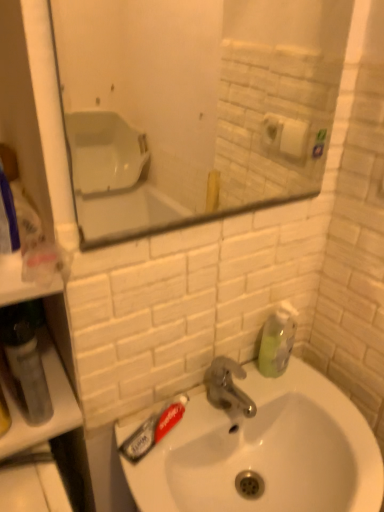
Describe the element at coordinates (25, 370) in the screenshot. The width and height of the screenshot is (384, 512). I see `translucent plastic mouthwash at left` at that location.

Image resolution: width=384 pixels, height=512 pixels. What do you see at coordinates (277, 340) in the screenshot?
I see `green translucent soap dispenser at right` at bounding box center [277, 340].

Identify the location of green translucent soap dispenser at right. The width and height of the screenshot is (384, 512). (277, 340).

Image resolution: width=384 pixels, height=512 pixels. Identify the location of white glossy sink at center. (265, 451).

What is the approximate height of white glossy sink at center?

white glossy sink at center is 5.68 inches tall.

At what (x,y) coordinates should I click in order to perform the action: click on translucent plastic toothpaste at sink left. Please return your answer as a coordinate pair (x, y). Looking at the image, I should click on (153, 429).

The image size is (384, 512). I want to click on translucent plastic mouthwash at left, so click(25, 370).

Is white glossy sink at center positioned behind translucent plastic mouthwash at left?

No.

Is white glossy sink at center at the right side of translucent plastic mouthwash at left?

Indeed, white glossy sink at center is positioned on the right side of translucent plastic mouthwash at left.

Is white glossy sink at center far from translucent plastic mouthwash at left?

No, white glossy sink at center is not far from translucent plastic mouthwash at left.

From a real-world perspective, is white glossy sink at center positioned above or below translucent plastic mouthwash at left?

In terms of real-world spatial position, white glossy sink at center is below translucent plastic mouthwash at left.

Considering the sizes of white glossy sink at center and matte glass mirror at upper center in the image, is white glossy sink at center wider or thinner than matte glass mirror at upper center?

Considering their sizes, white glossy sink at center looks broader than matte glass mirror at upper center.

Which of these two, white glossy sink at center or matte glass mirror at upper center, is smaller?

Smaller between the two is matte glass mirror at upper center.

In the scene shown: From the image's perspective, is white glossy sink at center on matte glass mirror at upper center?

No, from the image's perspective, white glossy sink at center is not over matte glass mirror at upper center.

How many degrees apart are the facing directions of matte glass mirror at upper center and white glossy sink at center?

0.299 degrees.

Is there a large distance between matte glass mirror at upper center and white glossy sink at center?

matte glass mirror at upper center is far away from white glossy sink at center.

Who is shorter, matte glass mirror at upper center or white glossy sink at center?

white glossy sink at center.

From the image's perspective, does matte glass mirror at upper center appear higher than white glossy sink at center?

Yes, from the image's perspective, matte glass mirror at upper center is on top of white glossy sink at center.

Is translucent plastic mouthwash at left located within green translucent soap dispenser at right?

No, translucent plastic mouthwash at left is not a part of green translucent soap dispenser at right.

Is green translucent soap dispenser at right to the left of translucent plastic mouthwash at left from the viewer's perspective?

No, green translucent soap dispenser at right is not to the left of translucent plastic mouthwash at left.

Between point (275, 371) and point (41, 416), which one is positioned behind?

The point (275, 371) is more distant.

This screenshot has height=512, width=384. I want to click on soap dispenser above the translucent plastic mouthwash at left (from the image's perspective), so click(277, 340).

Based on the photo, would you say translucent plastic toothpaste at sink left contains translucent plastic mouthwash at left?

No, translucent plastic toothpaste at sink left does not contain translucent plastic mouthwash at left.

Is translucent plastic mouthwash at left at the back of translucent plastic toothpaste at sink left?

That's not correct — translucent plastic toothpaste at sink left is not looking away from translucent plastic mouthwash at left.

From the image's perspective, is translucent plastic toothpaste at sink left located above translucent plastic mouthwash at left?

No.

Does translucent plastic toothpaste at sink left have a smaller size compared to translucent plastic mouthwash at left?

Yes.

Would you say translucent plastic mouthwash at left is outside green translucent soap dispenser at right?

Absolutely, translucent plastic mouthwash at left is external to green translucent soap dispenser at right.

Can you confirm if translucent plastic mouthwash at left is positioned to the left of green translucent soap dispenser at right?

Yes.

At what (x,y) coordinates should I click in order to perform the action: click on soap dispenser that appears below the translucent plastic mouthwash at left (from a real-world perspective). Please return your answer as a coordinate pair (x, y). The image size is (384, 512). Looking at the image, I should click on (277, 340).

Based on the photo, from a real-world perspective, is white glossy sink at center physically located above or below green translucent soap dispenser at right?

white glossy sink at center is situated lower than green translucent soap dispenser at right in the real world.

In terms of size, does white glossy sink at center appear bigger or smaller than green translucent soap dispenser at right?

In the image, white glossy sink at center appears to be larger than green translucent soap dispenser at right.

Is white glossy sink at center turned away from green translucent soap dispenser at right?

That's not correct — white glossy sink at center is not looking away from green translucent soap dispenser at right.

Which of these two, white glossy sink at center or green translucent soap dispenser at right, stands shorter?

white glossy sink at center is shorter.

Identify the location of sink beneath the translucent plastic mouthwash at left (from a real-world perspective). The image size is (384, 512). (265, 451).

This screenshot has width=384, height=512. I want to click on mirror on the left of white glossy sink at center, so click(194, 106).

Estimate the real-world distances between objects in this image. Which object is further from translucent plastic mouthwash at left, translucent plastic toothpaste at sink left or white glossy sink at center?

Based on the image, white glossy sink at center appears to be further to translucent plastic mouthwash at left.

Estimate the real-world distances between objects in this image. Which object is closer to green translucent soap dispenser at right, white glossy sink at center or translucent plastic mouthwash at left?

Based on the image, white glossy sink at center appears to be nearer to green translucent soap dispenser at right.

Estimate the real-world distances between objects in this image. Which object is closer to green translucent soap dispenser at right, translucent plastic mouthwash at left or translucent plastic toothpaste at sink left?

Among the two, translucent plastic toothpaste at sink left is located nearer to green translucent soap dispenser at right.

Based on their spatial positions, is translucent plastic toothpaste at sink left or matte glass mirror at upper center closer to green translucent soap dispenser at right?

translucent plastic toothpaste at sink left.

Based on their spatial positions, is matte glass mirror at upper center or green translucent soap dispenser at right closer to translucent plastic mouthwash at left?

green translucent soap dispenser at right lies closer to translucent plastic mouthwash at left than the other object.

Looking at the image, which one is located further to green translucent soap dispenser at right, translucent plastic mouthwash at left or white glossy sink at center?

translucent plastic mouthwash at left is further to green translucent soap dispenser at right.

From the image, which object appears to be nearer to matte glass mirror at upper center, translucent plastic mouthwash at left or green translucent soap dispenser at right?

The object closer to matte glass mirror at upper center is green translucent soap dispenser at right.

Based on their spatial positions, is green translucent soap dispenser at right or matte glass mirror at upper center closer to translucent plastic mouthwash at left?

green translucent soap dispenser at right lies closer to translucent plastic mouthwash at left than the other object.

The height and width of the screenshot is (512, 384). In order to click on soap dispenser between matte glass mirror at upper center and translucent plastic toothpaste at sink left from top to bottom in this screenshot , I will do `click(277, 340)`.

Where is `mirror situated between translucent plastic mouthwash at left and green translucent soap dispenser at right from left to right`? mirror situated between translucent plastic mouthwash at left and green translucent soap dispenser at right from left to right is located at coordinates (194, 106).

Locate an element on the screen. Image resolution: width=384 pixels, height=512 pixels. toothpaste located between white glossy sink at center and green translucent soap dispenser at right in the depth direction is located at coordinates (153, 429).

Identify the location of toothpaste between translucent plastic mouthwash at left and white glossy sink at center in the horizontal direction. The height and width of the screenshot is (512, 384). (153, 429).